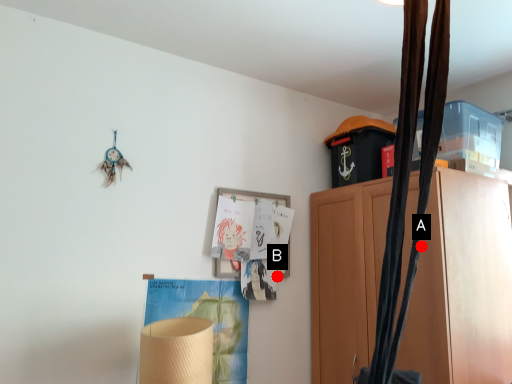
Question: Two points are circled on the image, labeled by A and B beside each circle. Which point is farther to the camera?

Choices:
 (A) A is further
 (B) B is further

Answer: (B)